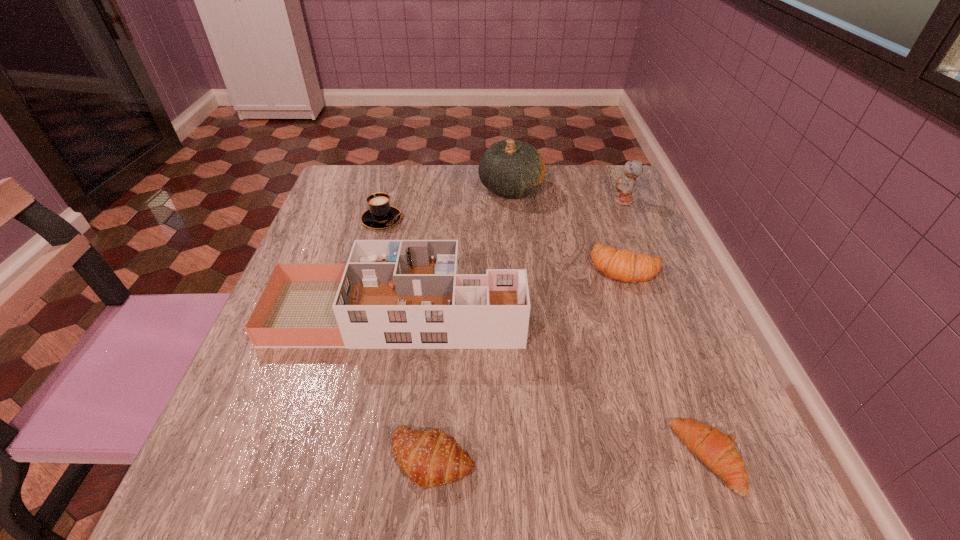
Where is `free location that satisfies the following two spatial constraints: 1. on the back side of the second shortest crescent roll; 2. on the right side of the tallest object`? The image size is (960, 540). free location that satisfies the following two spatial constraints: 1. on the back side of the second shortest crescent roll; 2. on the right side of the tallest object is located at coordinates (454, 188).

I want to click on vacant region that satisfies the following two spatial constraints: 1. on the front side of the gourd; 2. on the left side of the shortest crescent roll, so click(537, 457).

Where is `vacant space that satisfies the following two spatial constraints: 1. on the front side of the cappuccino; 2. on the left side of the second shortest object`? This screenshot has height=540, width=960. vacant space that satisfies the following two spatial constraints: 1. on the front side of the cappuccino; 2. on the left side of the second shortest object is located at coordinates (317, 458).

The height and width of the screenshot is (540, 960). I want to click on free location that satisfies the following two spatial constraints: 1. on the front side of the gourd; 2. on the left side of the shortest object, so click(x=537, y=457).